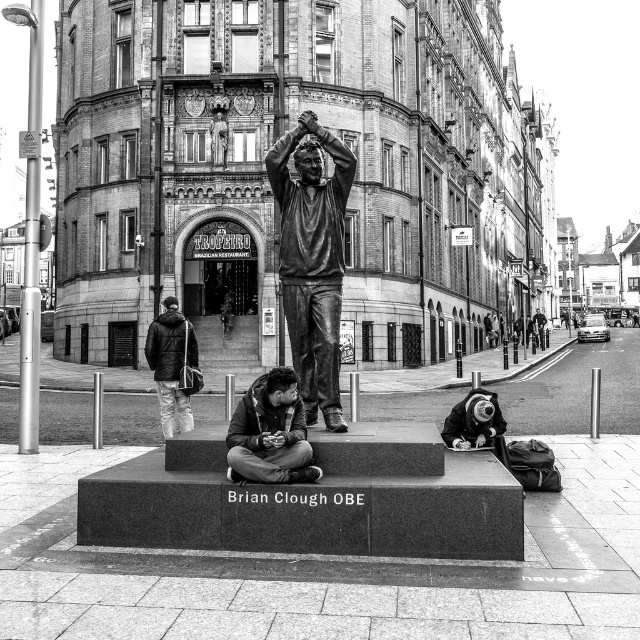
Based on the photo, does bronze statue at center have a smaller size compared to dark gray jacket at left?

Actually, bronze statue at center might be larger than dark gray jacket at left.

How far apart are bronze statue at center and dark gray jacket at left?

bronze statue at center is 11.67 meters from dark gray jacket at left.

Who is more distant from viewer, (289,285) or (172,326)?

The point (172,326) is more distant.

The height and width of the screenshot is (640, 640). Find the location of `bronze statue at center`. bronze statue at center is located at coordinates coord(312,259).

From the picture: Who is taller, bronze statue at center or dark brown leather jacket at center?

Standing taller between the two is bronze statue at center.

Looking at this image, can you confirm if bronze statue at center is bigger than dark brown leather jacket at center?

Indeed, bronze statue at center has a larger size compared to dark brown leather jacket at center.

Between point (317, 195) and point (288, 445), which one is positioned in front?

Point (288, 445) is more forward.

At what (x,y) coordinates should I click in order to perform the action: click on bronze statue at center. Please return your answer as a coordinate pair (x, y). This screenshot has height=640, width=640. Looking at the image, I should click on (312, 259).

Which is in front, point (243, 449) or point (164, 314)?

Positioned in front is point (243, 449).

Which of these two, dark brown leather jacket at center or dark gray jacket at left, stands taller?

Standing taller between the two is dark gray jacket at left.

Is point (262, 417) positioned before point (157, 355)?

Yes, point (262, 417) is closer to viewer.

Where is `dark brown leather jacket at center`? dark brown leather jacket at center is located at coordinates (269, 433).